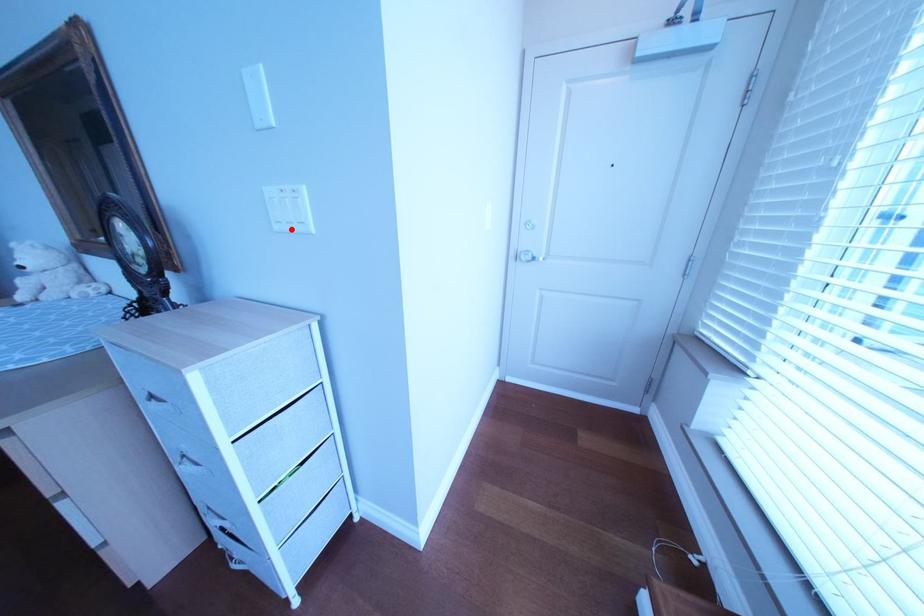
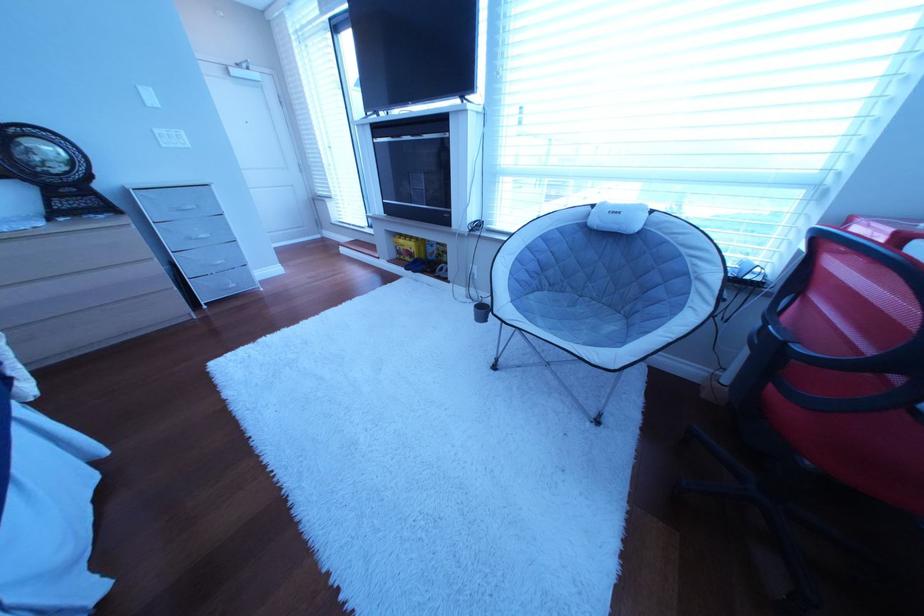
Locate, in the second image, the point that corresponds to the highlighted location in the first image.

(179, 148)